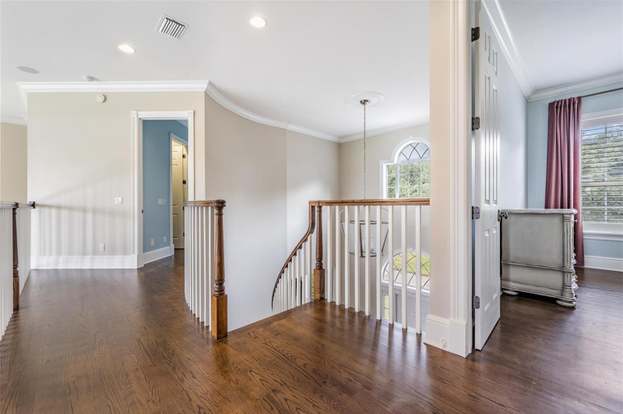
I want to click on light shining on the floor, so pos(400,334), pos(412,336).